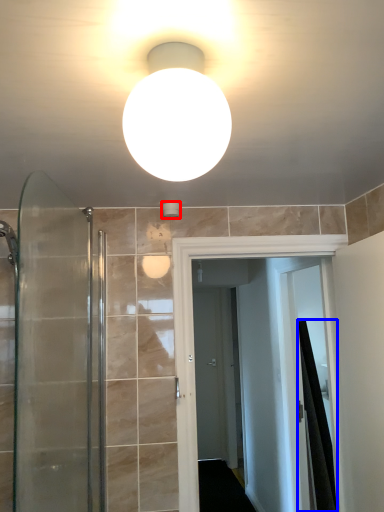
Question: Which point is closer to the camera, fixture (highlighted by a red box) or shower curtain (highlighted by a blue box)?

Choices:
 (A) fixture
 (B) shower curtain

Answer: (A)